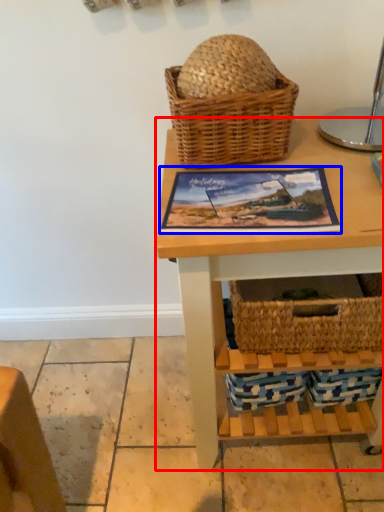
Question: Which of the following is the farthest to the observer, table (highlighted by a red box) or picture frame (highlighted by a blue box)?

Choices:
 (A) table
 (B) picture frame

Answer: (B)